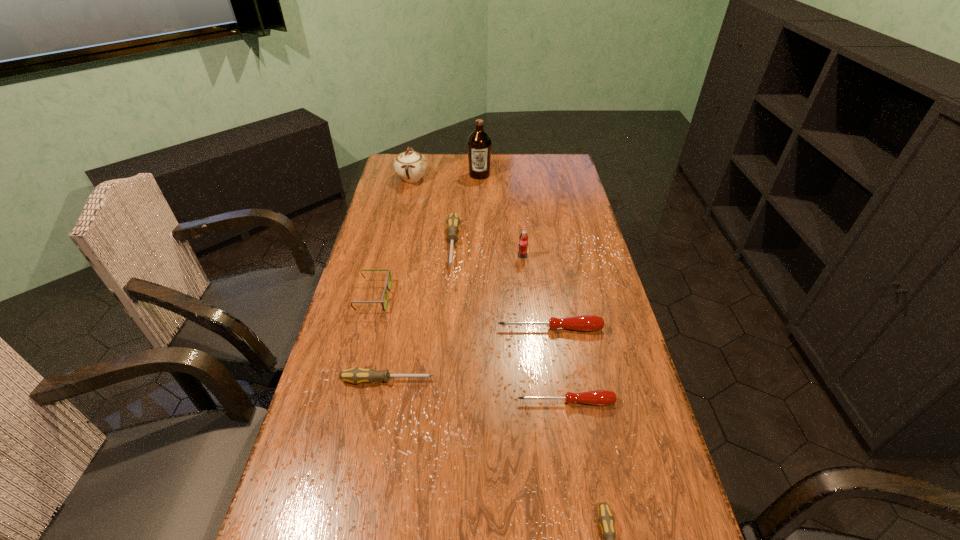
Find the location of a particular element. the second smallest gray screwdriver is located at coordinates (357, 375).

This screenshot has height=540, width=960. I want to click on the second farthest gray screwdriver, so click(357, 375).

This screenshot has width=960, height=540. What are the coordinates of `the fourth farthest screwdriver` in the screenshot? It's located at (597, 397).

What are the coordinates of `the second nearest object` in the screenshot? It's located at (597, 397).

Find the location of a particular element. free space located 0.170m on the label of the olive oil is located at coordinates (479, 202).

In order to click on vacant space located on the front of the chinaware in this screenshot , I will do `click(406, 203)`.

Find the location of a particular element. The image size is (960, 540). free spot located on the label of the third tallest object is located at coordinates (532, 339).

The height and width of the screenshot is (540, 960). In order to click on vacant space positioned at the tip of the farthest screwdriver in this screenshot , I will do `click(448, 304)`.

Image resolution: width=960 pixels, height=540 pixels. Identify the location of vacant space located on the lens of the spectacles. (469, 296).

Locate an element on the screen. Image resolution: width=960 pixels, height=540 pixels. free location located on the back of the second farthest screwdriver is located at coordinates [x=540, y=261].